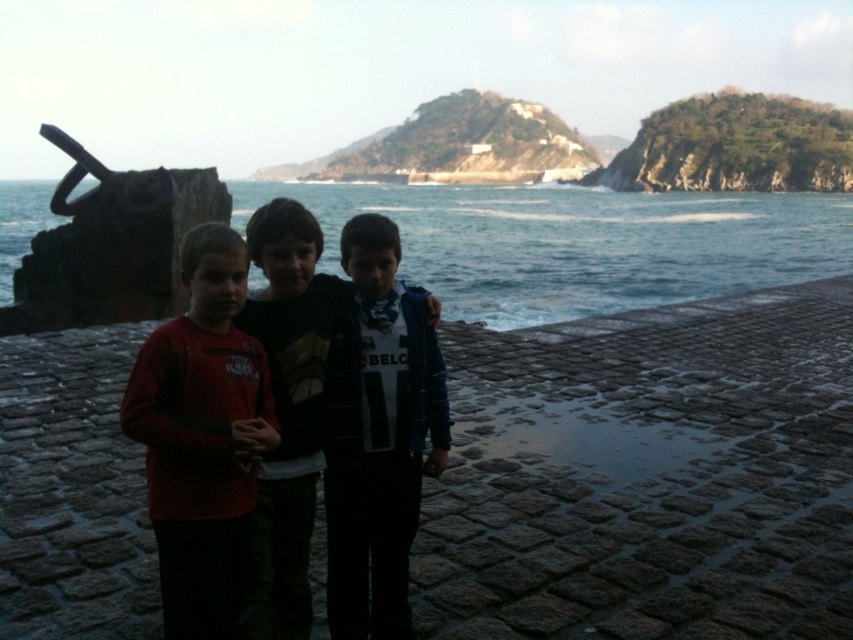
Question: Is smooth stone pavement at center behind rusty metal anchor at left?

Choices:
 (A) no
 (B) yes

Answer: (A)

Question: Which point is closer to the camera taking this photo?

Choices:
 (A) (686, 316)
 (B) (259, 588)
 (C) (519, 268)

Answer: (B)

Question: Which of these objects is positioned farthest from the dark blue jersey at center?

Choices:
 (A) smooth stone pavement at center
 (B) rusty metal anchor at left

Answer: (B)

Question: Is blue water at center above red long-sleeve shirt at center?

Choices:
 (A) no
 (B) yes

Answer: (B)

Question: Which of the following is the farthest from the observer?

Choices:
 (A) blue water at center
 (B) red long-sleeve shirt at center
 (C) dark blue jersey at center
 (D) rusty metal anchor at left

Answer: (D)

Question: Can you confirm if red long-sleeve shirt at center is positioned above rusty metal anchor at left?

Choices:
 (A) yes
 (B) no

Answer: (B)